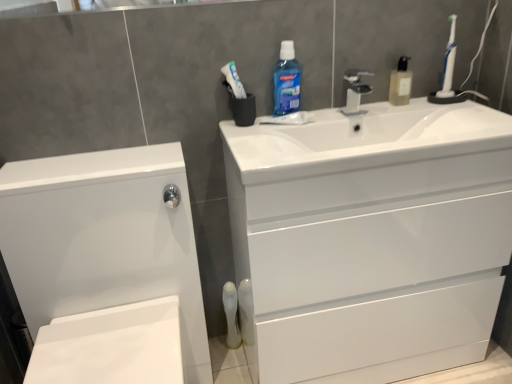
Question: From a real-world perspective, is translucent plastic soap dispenser at upper right, the 1th cleaning product from the right, above or below satin nickel faucet at center?

Choices:
 (A) above
 (B) below

Answer: (A)

Question: In terms of height, does translucent plastic soap dispenser at upper right, the 1th cleaning product from the right, look taller or shorter compared to satin nickel faucet at center?

Choices:
 (A) tall
 (B) short

Answer: (A)

Question: Based on their relative distances, which object is nearer to the white plastic toothbrush at upper right?

Choices:
 (A) blue translucent liquid at upper center, the first cleaning product viewed from the left
 (B) white glossy sink at upper center
 (C) white glossy cabinet at lower left
 (D) translucent plastic mouthwash at lower center
 (E) white glossy drawer at center

Answer: (E)

Question: Which is farther from the blue translucent liquid at upper center, acting as the second cleaning product starting from the right?

Choices:
 (A) white glossy drawer at center
 (B) satin nickel faucet at center
 (C) white glossy sink at upper center
 (D) white glossy cabinet at lower left
 (E) translucent plastic mouthwash at lower center

Answer: (E)